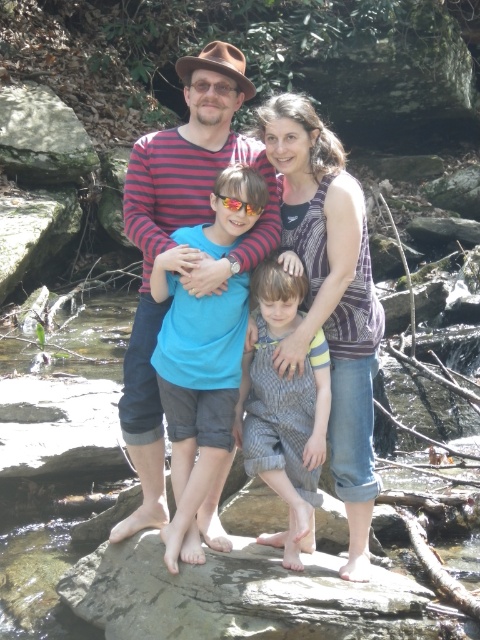
Can you confirm if striped fabric tank top at center is bigger than gray striped overalls at center?

Incorrect, striped fabric tank top at center is not larger than gray striped overalls at center.

You are a GUI agent. You are given a task and a screenshot of the screen. Output one action in this format:
    pyautogui.click(x=<x>, y=<y>)
    Task: Click on the striped fabric tank top at center
    The width and height of the screenshot is (480, 640).
    Given the screenshot: What is the action you would take?
    pyautogui.click(x=331, y=296)

Is point (336, 246) positioned before point (23, 97)?

Yes, point (336, 246) is closer to viewer.

Which is above, striped fabric tank top at center or green mossy rock at upper left?

Positioned higher is green mossy rock at upper left.

Between point (336, 401) and point (33, 164), which one is positioned in front?

Point (336, 401)

Image resolution: width=480 pixels, height=640 pixels. Find the location of `striped fabric tank top at center`. striped fabric tank top at center is located at coordinates (331, 296).

Does gray rough rock at center have a greater width compared to gray striped overalls at center?

Indeed, gray rough rock at center has a greater width compared to gray striped overalls at center.

Which is in front, point (250, 595) or point (276, 406)?

Point (250, 595) is more forward.

Identify the location of gray rough rock at center. Image resolution: width=480 pixels, height=640 pixels. (238, 596).

Image resolution: width=480 pixels, height=640 pixels. Find the location of `gray rough rock at center`. gray rough rock at center is located at coordinates (238, 596).